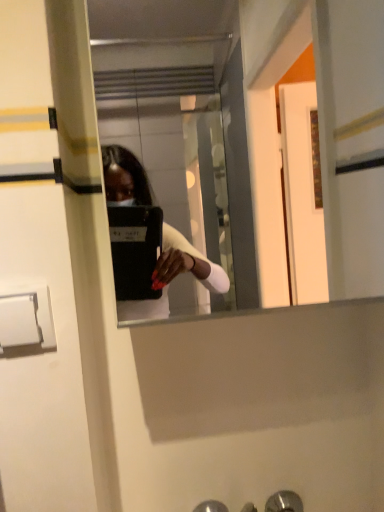
Image resolution: width=384 pixels, height=512 pixels. Find the location of `white plastic door handle at lower left, the first door handle in the top-to-bottom sequence`. white plastic door handle at lower left, the first door handle in the top-to-bottom sequence is located at coordinates (26, 319).

This screenshot has height=512, width=384. Describe the element at coordinates (284, 502) in the screenshot. I see `metallic silver door handle at lower center, which is the first door handle in right-to-left order` at that location.

Locate an element on the screen. The height and width of the screenshot is (512, 384). clear glass mirror at center is located at coordinates (248, 136).

Is clear glass mirror at center at the back of metallic silver door handle at lower center, the 1th door handle in the bottom-to-top sequence?

metallic silver door handle at lower center, the 1th door handle in the bottom-to-top sequence, does not have its back to clear glass mirror at center.

Is metallic silver door handle at lower center, which is the second door handle in top-to-bottom order, located outside clear glass mirror at center?

Yes, metallic silver door handle at lower center, which is the second door handle in top-to-bottom order, is located beyond the bounds of clear glass mirror at center.

Which is behind, point (285, 496) or point (380, 159)?

The point (285, 496) is farther.

Is metallic silver door handle at lower center, which is the first door handle in right-to-left order, in front of or behind clear glass mirror at center in the image?

Visually, metallic silver door handle at lower center, which is the first door handle in right-to-left order, is located behind clear glass mirror at center.

From the image's perspective, does white plastic door handle at lower left, which ranks as the 2th door handle in back-to-front order, appear lower than metallic silver door handle at lower center, the 1th door handle in the back-to-front sequence?

Actually, white plastic door handle at lower left, which ranks as the 2th door handle in back-to-front order, appears above metallic silver door handle at lower center, the 1th door handle in the back-to-front sequence, in the image.

How far apart are white plastic door handle at lower left, the 1th door handle from the front, and metallic silver door handle at lower center, the 1th door handle in the back-to-front sequence?

white plastic door handle at lower left, the 1th door handle from the front, and metallic silver door handle at lower center, the 1th door handle in the back-to-front sequence, are 61.05 centimeters apart.

Considering the relative positions of white plastic door handle at lower left, which ranks as the 2th door handle in back-to-front order, and metallic silver door handle at lower center, marked as the second door handle in a front-to-back arrangement, in the image provided, is white plastic door handle at lower left, which ranks as the 2th door handle in back-to-front order, to the left or to the right of metallic silver door handle at lower center, marked as the second door handle in a front-to-back arrangement,?

Based on their positions, white plastic door handle at lower left, which ranks as the 2th door handle in back-to-front order, is located to the left of metallic silver door handle at lower center, marked as the second door handle in a front-to-back arrangement.

Can you see white plastic door handle at lower left, the 1th door handle from the front, touching metallic silver door handle at lower center, positioned as the 2th door handle in left-to-right order?

white plastic door handle at lower left, the 1th door handle from the front, and metallic silver door handle at lower center, positioned as the 2th door handle in left-to-right order, are clearly separated.

Does white plastic door handle at lower left, the first door handle in the top-to-bottom sequence, contain clear glass mirror at center?

No, white plastic door handle at lower left, the first door handle in the top-to-bottom sequence, does not contain clear glass mirror at center.

Considering the positions of points (47, 290) and (333, 282), is point (47, 290) farther from camera compared to point (333, 282)?

No, (47, 290) is closer to viewer.

Is white plastic door handle at lower left, the 1th door handle from the left, placed right next to clear glass mirror at center?

No, white plastic door handle at lower left, the 1th door handle from the left, is not beside clear glass mirror at center.

From the image's perspective, does clear glass mirror at center appear higher than metallic silver door handle at lower center, the 1th door handle in the back-to-front sequence?

Yes, from the image's perspective, clear glass mirror at center is on top of metallic silver door handle at lower center, the 1th door handle in the back-to-front sequence.

Does clear glass mirror at center have a greater width compared to metallic silver door handle at lower center, marked as the second door handle in a front-to-back arrangement?

Yes, clear glass mirror at center is wider than metallic silver door handle at lower center, marked as the second door handle in a front-to-back arrangement.

Is point (202, 42) more distant than point (297, 495)?

Yes, point (202, 42) is behind point (297, 495).

This screenshot has height=512, width=384. I want to click on mirror that appears above the metallic silver door handle at lower center, positioned as the 2th door handle in left-to-right order (from a real-world perspective), so click(x=248, y=136).

Which is in front, metallic silver door handle at lower center, which is the second door handle in top-to-bottom order, or white plastic door handle at lower left, the 1th door handle from the left?

white plastic door handle at lower left, the 1th door handle from the left.

Is point (289, 511) positioned behind point (19, 344)?

Yes, point (289, 511) is behind point (19, 344).

From a real-world perspective, is metallic silver door handle at lower center, which is the first door handle in right-to-left order, physically below white plastic door handle at lower left, the 1th door handle from the front?

Yes, from a real-world perspective, metallic silver door handle at lower center, which is the first door handle in right-to-left order, is beneath white plastic door handle at lower left, the 1th door handle from the front.

Is clear glass mirror at center completely or partially outside of white plastic door handle at lower left, placed as the second door handle when sorted from bottom to top?

clear glass mirror at center is positioned outside white plastic door handle at lower left, placed as the second door handle when sorted from bottom to top.

In the scene shown: Would you say clear glass mirror at center is a long distance from white plastic door handle at lower left, the 1th door handle from the front?

clear glass mirror at center is positioned a significant distance from white plastic door handle at lower left, the 1th door handle from the front.

The height and width of the screenshot is (512, 384). I want to click on the 1st door handle behind when counting from the clear glass mirror at center, so click(26, 319).

Is clear glass mirror at center positioned with its back to white plastic door handle at lower left, the 1th door handle from the front?

No, clear glass mirror at center's orientation is not away from white plastic door handle at lower left, the 1th door handle from the front.

Where is `mirror on the left of metallic silver door handle at lower center, marked as the second door handle in a front-to-back arrangement`? mirror on the left of metallic silver door handle at lower center, marked as the second door handle in a front-to-back arrangement is located at coordinates (248, 136).

Locate an element on the screen. door handle above the metallic silver door handle at lower center, positioned as the 2th door handle in left-to-right order (from the image's perspective) is located at coordinates (26, 319).

Looking at the image, which one is located closer to white plastic door handle at lower left, which ranks as the 2th door handle in back-to-front order, clear glass mirror at center or metallic silver door handle at lower center, the 1th door handle in the bottom-to-top sequence?

metallic silver door handle at lower center, the 1th door handle in the bottom-to-top sequence, lies closer to white plastic door handle at lower left, which ranks as the 2th door handle in back-to-front order, than the other object.

Based on their spatial positions, is white plastic door handle at lower left, the 1th door handle from the front, or metallic silver door handle at lower center, which is the first door handle in right-to-left order, further from clear glass mirror at center?

white plastic door handle at lower left, the 1th door handle from the front, lies further to clear glass mirror at center than the other object.

When comparing their distances from metallic silver door handle at lower center, the 1th door handle in the bottom-to-top sequence, does clear glass mirror at center or white plastic door handle at lower left, placed as the second door handle when sorted from bottom to top, seem closer?

white plastic door handle at lower left, placed as the second door handle when sorted from bottom to top, lies closer to metallic silver door handle at lower center, the 1th door handle in the bottom-to-top sequence, than the other object.

Based on their spatial positions, is metallic silver door handle at lower center, the 1th door handle in the bottom-to-top sequence, or clear glass mirror at center further from white plastic door handle at lower left, the 1th door handle from the left?

clear glass mirror at center.

From the image, which object appears to be nearer to clear glass mirror at center, metallic silver door handle at lower center, the 1th door handle in the bottom-to-top sequence, or white plastic door handle at lower left, the 1th door handle from the front?

metallic silver door handle at lower center, the 1th door handle in the bottom-to-top sequence, is positioned closer to the anchor clear glass mirror at center.

From the image, which object appears to be nearer to metallic silver door handle at lower center, positioned as the 2th door handle in left-to-right order, white plastic door handle at lower left, the 1th door handle from the left, or clear glass mirror at center?

white plastic door handle at lower left, the 1th door handle from the left, is positioned closer to the anchor metallic silver door handle at lower center, positioned as the 2th door handle in left-to-right order.

Find the location of a particular element. The image size is (384, 512). door handle between clear glass mirror at center and metallic silver door handle at lower center, positioned as the 2th door handle in left-to-right order, in the up-down direction is located at coordinates (26, 319).